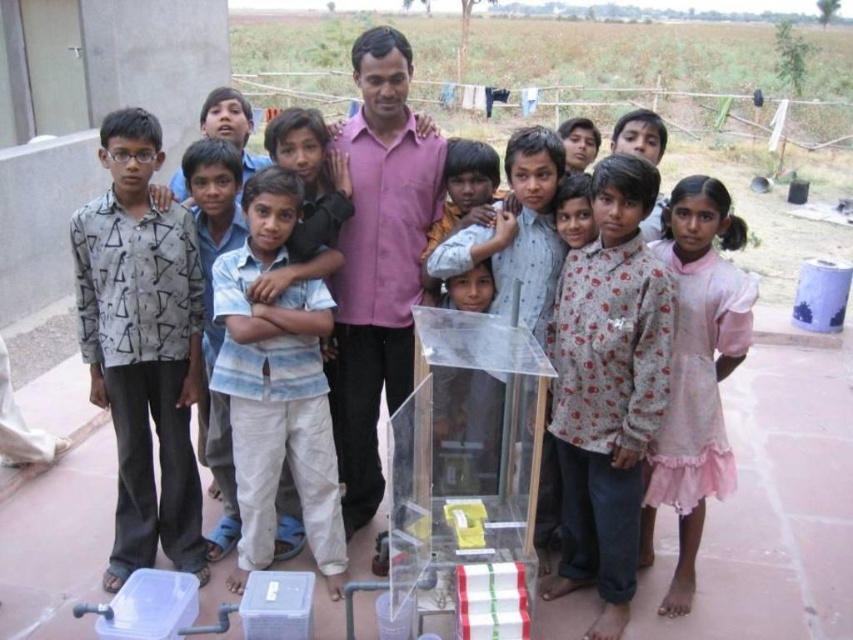
Question: Can you confirm if pink satin dress at center is wider than light brown fabric shirt at center?

Choices:
 (A) no
 (B) yes

Answer: (B)

Question: Which of the following is the farthest from the observer?

Choices:
 (A) light brown fabric shirt at center
 (B) blue striped shirt at center
 (C) floral-patterned shirt at center
 (D) pink satin dress at center

Answer: (A)

Question: Estimate the real-world distances between objects in this image. Which object is farther from the pink satin dress at center?

Choices:
 (A) floral-patterned shirt at center
 (B) pink cotton shirt at center
 (C) printed cotton shirt at left
 (D) light brown fabric shirt at center

Answer: (C)

Question: Which object is farther from the camera taking this photo?

Choices:
 (A) pink satin dress at center
 (B) pink cotton shirt at center
 (C) floral-patterned shirt at center
 (D) light brown fabric shirt at center

Answer: (D)

Question: Does pink cotton shirt at center lie in front of light brown fabric shirt at center?

Choices:
 (A) yes
 (B) no

Answer: (A)

Question: Is floral-patterned shirt at center to the left of blue striped shirt at center from the viewer's perspective?

Choices:
 (A) no
 (B) yes

Answer: (A)